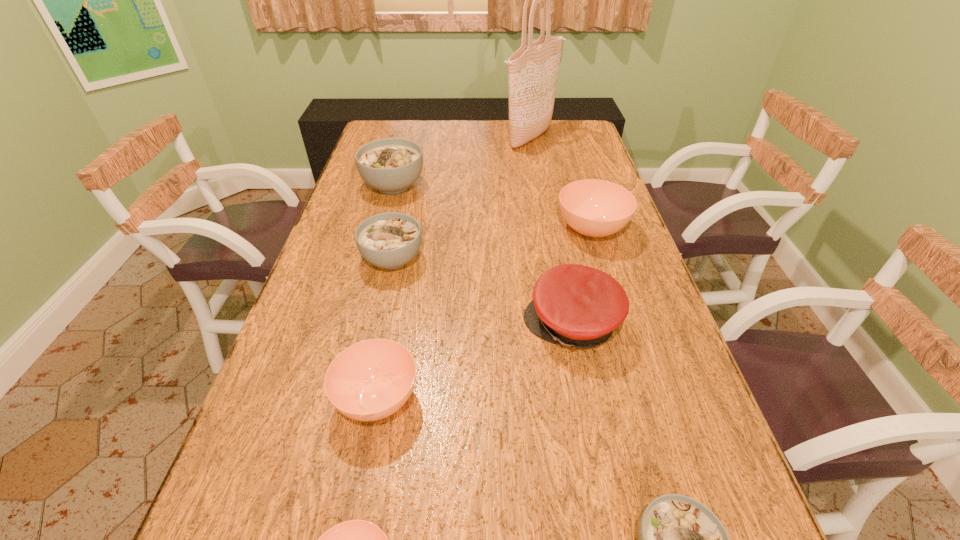
Find the location of `the tallest object`. the tallest object is located at coordinates (533, 69).

Identify the location of shopping bag. This screenshot has height=540, width=960. (533, 69).

The width and height of the screenshot is (960, 540). What are the coordinates of `the biggest white soup bowl` in the screenshot? It's located at (391, 165).

Locate an element on the screen. Image resolution: width=960 pixels, height=540 pixels. the tallest soup bowl is located at coordinates (391, 165).

Find the location of `the biggest peach soup bowl`. the biggest peach soup bowl is located at coordinates (596, 208).

Where is `the farthest peach soup bowl`? The width and height of the screenshot is (960, 540). the farthest peach soup bowl is located at coordinates (596, 208).

You are a GUI agent. You are given a task and a screenshot of the screen. Output one action in this format:
    pyautogui.click(x=<x>, y=<y>)
    Task: Click on the fourth nearest object
    
    Given the screenshot: What is the action you would take?
    pyautogui.click(x=577, y=306)

The width and height of the screenshot is (960, 540). What are the coordinates of `cap` in the screenshot? It's located at (577, 306).

Locate an element on the screen. the second smallest white soup bowl is located at coordinates (390, 240).

Where is `the sixth farthest object`? Image resolution: width=960 pixels, height=540 pixels. the sixth farthest object is located at coordinates (370, 380).